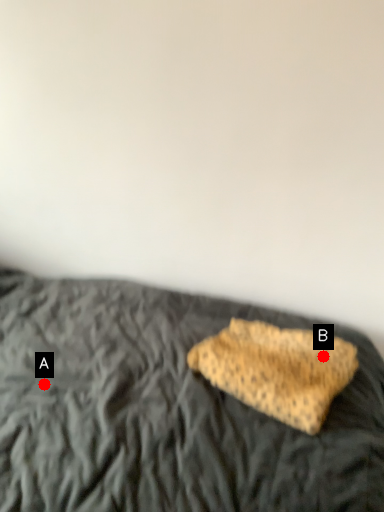
Question: Two points are circled on the image, labeled by A and B beside each circle. Which point is closer to the camera taking this photo?

Choices:
 (A) A is closer
 (B) B is closer

Answer: (B)